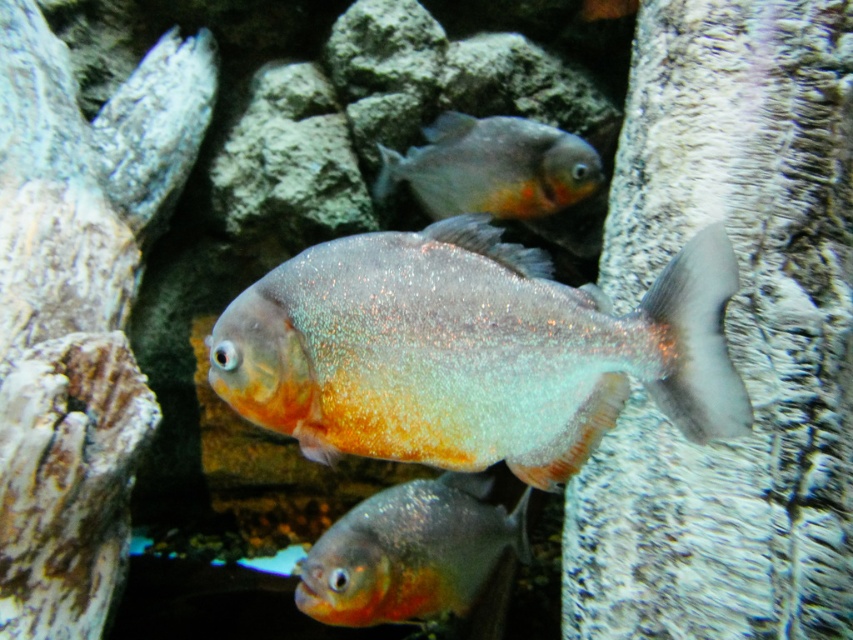
Does shiny orange fish at center appear on the left side of shiny orange fish at upper center?

Correct, you'll find shiny orange fish at center to the left of shiny orange fish at upper center.

I want to click on shiny orange fish at center, so click(x=410, y=552).

Is point (492, 508) positioned behind point (500, 208)?

That is False.

Identify the location of shiny orange fish at center. (410, 552).

Which is more to the left, shiny metallic fish at center or shiny orange fish at upper center?

shiny metallic fish at center is more to the left.

Can you confirm if shiny metallic fish at center is wider than shiny orange fish at upper center?

No, shiny metallic fish at center is not wider than shiny orange fish at upper center.

Find the location of a particular element. The height and width of the screenshot is (640, 853). shiny metallic fish at center is located at coordinates (473, 352).

Who is higher up, shiny metallic fish at center or shiny orange fish at center?

shiny metallic fish at center is higher up.

Which is behind, point (440, 284) or point (428, 588)?

The point (428, 588) is more distant.

Where is `shiny metallic fish at center`? The image size is (853, 640). shiny metallic fish at center is located at coordinates (473, 352).